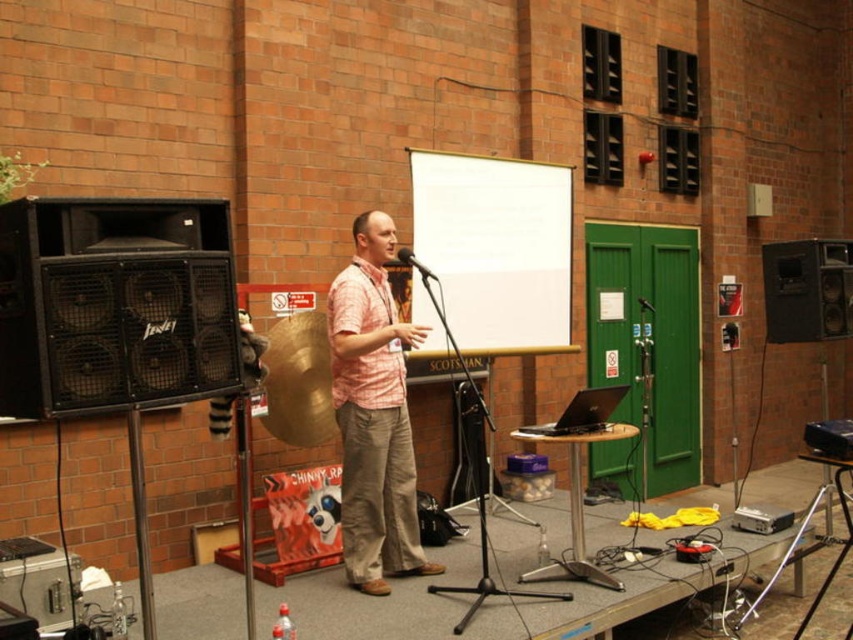
Question: Is white matte projection screen at center smaller than black matte speaker at right?

Choices:
 (A) yes
 (B) no

Answer: (B)

Question: Among these objects, which one is nearest to the camera?

Choices:
 (A) white matte projection screen at center
 (B) black matte speaker at right
 (C) black matte speaker at left

Answer: (C)

Question: Does white matte projection screen at center have a larger size compared to brass cymbal at center?

Choices:
 (A) no
 (B) yes

Answer: (B)

Question: Is silver metallic laptop at center positioned at the back of metallic silver microphone at center?

Choices:
 (A) no
 (B) yes

Answer: (A)

Question: Which of the following is the farthest from the observer?

Choices:
 (A) black matte speaker at right
 (B) white matte projection screen at center
 (C) matte black microphone at center

Answer: (A)

Question: Which point is farther to the camera?

Choices:
 (A) black matte speaker at left
 (B) white matte projection screen at center

Answer: (B)